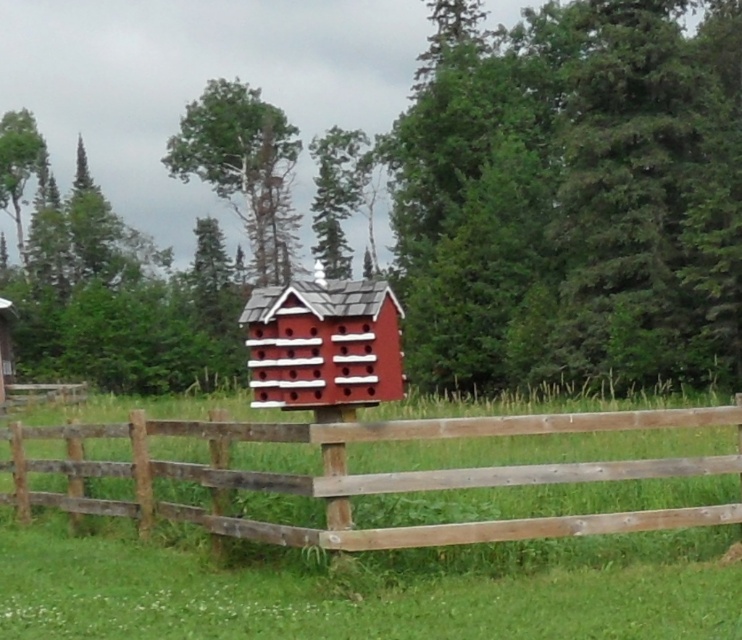
Question: Which object is closer to the camera taking this photo?

Choices:
 (A) wooden fence at center
 (B) matte red wooden birdhouse at center

Answer: (B)

Question: Can you confirm if wooden fence at center is positioned below matte red wooden birdhouse at center?

Choices:
 (A) yes
 (B) no

Answer: (A)

Question: Considering the relative positions of wooden fence at center and matte red wooden birdhouse at center in the image provided, where is wooden fence at center located with respect to matte red wooden birdhouse at center?

Choices:
 (A) right
 (B) left

Answer: (A)

Question: Which point appears farthest from the camera in this image?

Choices:
 (A) (395, 317)
 (B) (70, 484)

Answer: (B)

Question: Among these objects, which one is nearest to the camera?

Choices:
 (A) matte red wooden birdhouse at center
 (B) wooden fence at center

Answer: (A)

Question: Does wooden fence at center appear over matte red wooden birdhouse at center?

Choices:
 (A) yes
 (B) no

Answer: (B)